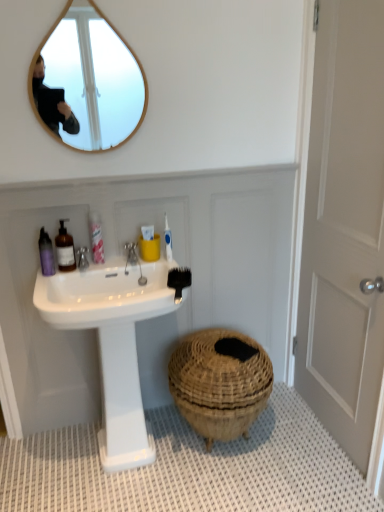
At what (x,y) coordinates should I click in order to perform the action: click on vacant space situated on the left part of white glossy sink at center. Please return your answer as a coordinate pair (x, y). Image resolution: width=384 pixels, height=512 pixels. Looking at the image, I should click on (34, 467).